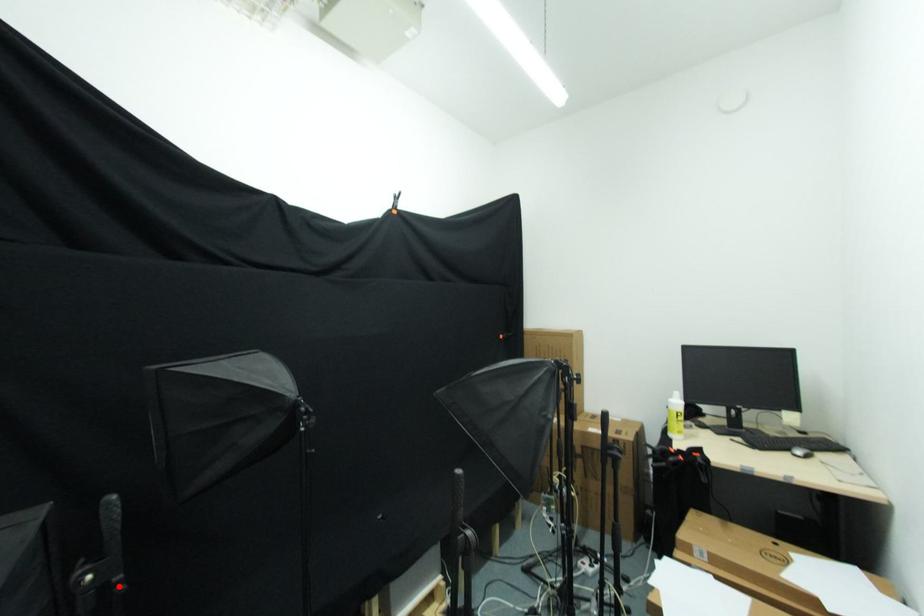
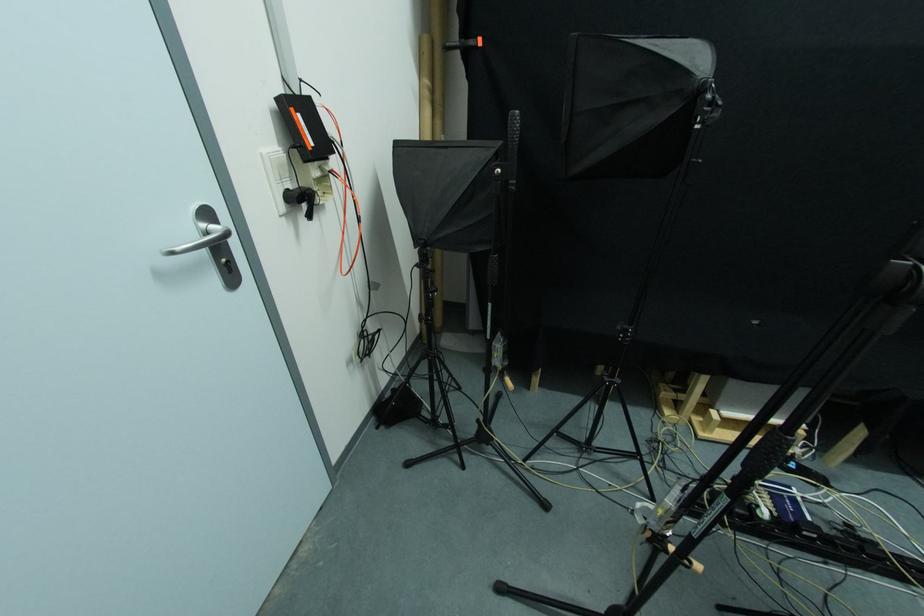
Locate, in the second image, the point that corresponds to the highlighted location in the first image.

(515, 187)